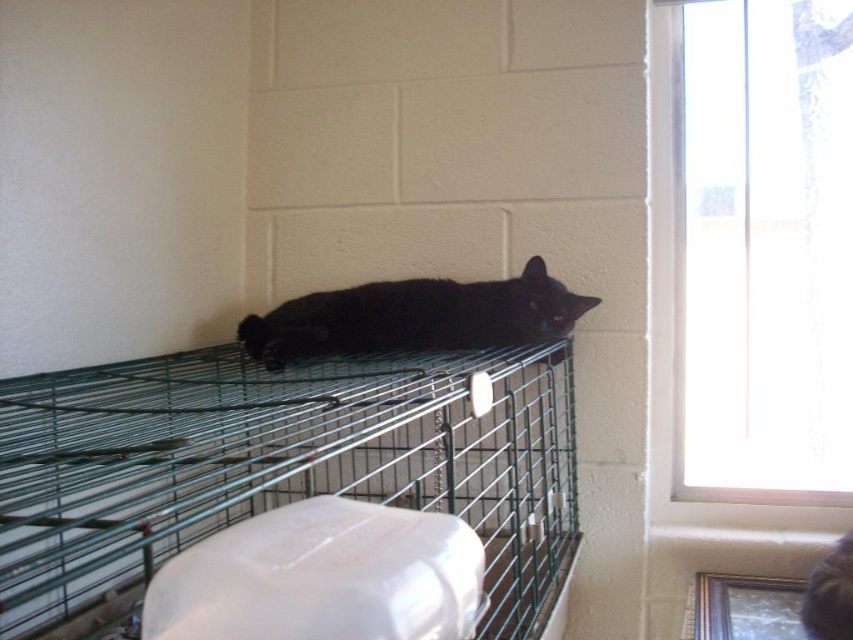
Question: Is green wire cage at upper center thinner than black matte fur cat at center?

Choices:
 (A) no
 (B) yes

Answer: (A)

Question: Which point is closer to the camera?

Choices:
 (A) green wire cage at upper center
 (B) black matte fur cat at center

Answer: (A)

Question: Observing the image, what is the correct spatial positioning of green wire cage at upper center in reference to black matte fur cat at center?

Choices:
 (A) below
 (B) above

Answer: (A)

Question: Is green wire cage at upper center in front of black matte fur cat at center?

Choices:
 (A) yes
 (B) no

Answer: (A)